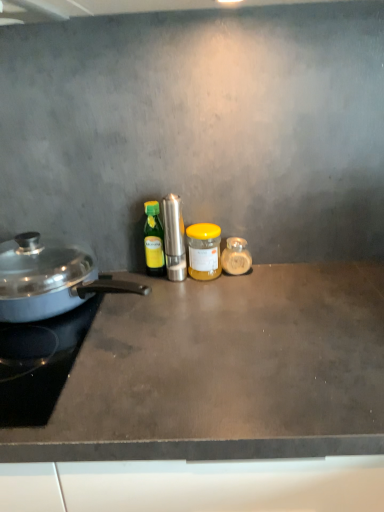
The image size is (384, 512). In order to click on free space in front of translucent glass jar at center, acting as the 5th kitchen appliance starting from the left in this screenshot , I will do `click(245, 302)`.